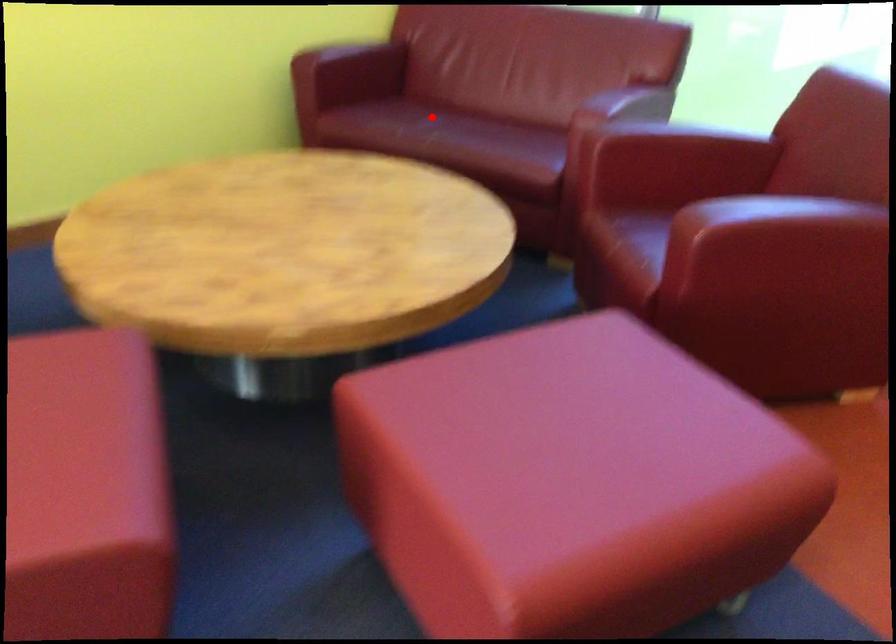
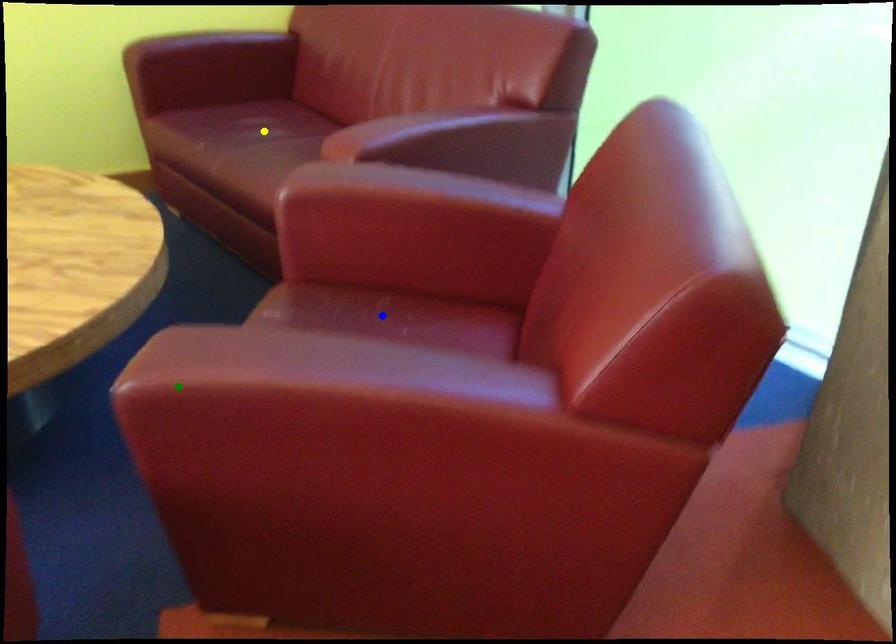
Question: I am providing you with two images of the same scene from different viewpoints. A red point is marked on the first image. You are given multiple points on the second image. Can you choose the point in image 2 that corresponds to the point in image 1?

Choices:
 (A) blue point
 (B) yellow point
 (C) green point

Answer: (B)